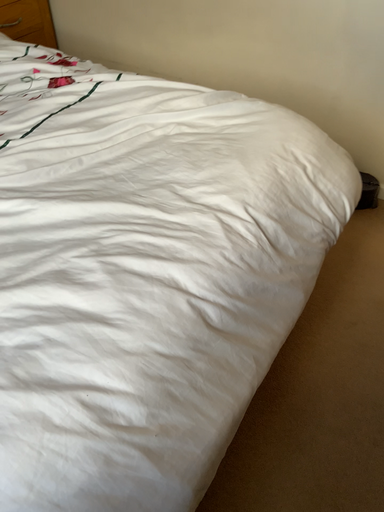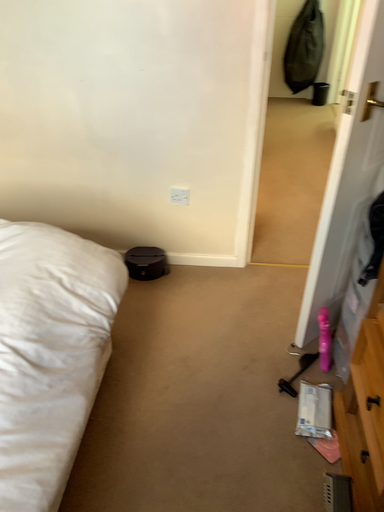
Question: How did the camera likely rotate when shooting the video?

Choices:
 (A) rotated left
 (B) rotated right

Answer: (B)